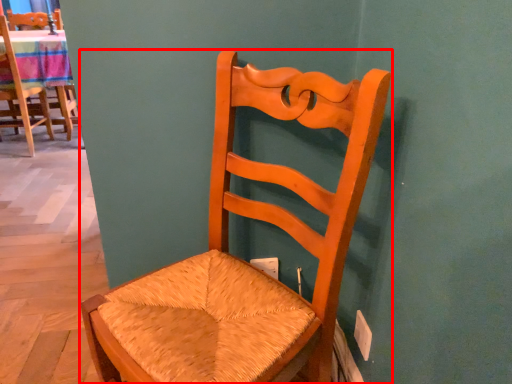
Question: From the image's perspective, where is chair (annotated by the red box) located relative to chair?

Choices:
 (A) below
 (B) above

Answer: (A)